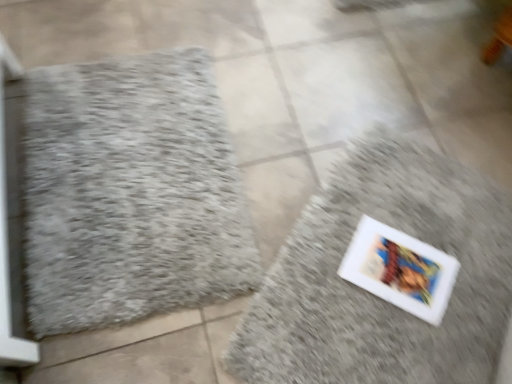
Question: Is gray fluffy bath mat at left, which appears as the 1th bath mat when viewed from the left, shorter than white matte book at lower right, marked as the second bath mat in a left-to-right arrangement?

Choices:
 (A) yes
 (B) no

Answer: (A)

Question: Considering the relative sizes of gray fluffy bath mat at left, the 2th bath mat when ordered from right to left, and white matte book at lower right, the first bath mat from the right, in the image provided, is gray fluffy bath mat at left, the 2th bath mat when ordered from right to left, smaller than white matte book at lower right, the first bath mat from the right,?

Choices:
 (A) yes
 (B) no

Answer: (A)

Question: From the image's perspective, is gray fluffy bath mat at left, which appears as the 1th bath mat when viewed from the left, located beneath white matte book at lower right, the first bath mat from the right?

Choices:
 (A) no
 (B) yes

Answer: (A)

Question: Is gray fluffy bath mat at left, the 2th bath mat when ordered from right to left, further to the viewer compared to white matte book at lower right, marked as the second bath mat in a left-to-right arrangement?

Choices:
 (A) no
 (B) yes

Answer: (B)

Question: Is the position of gray fluffy bath mat at left, which appears as the 1th bath mat when viewed from the left, less distant than that of white matte book at lower right, marked as the second bath mat in a left-to-right arrangement?

Choices:
 (A) yes
 (B) no

Answer: (B)

Question: Can white matte book at lower right, marked as the second bath mat in a left-to-right arrangement, be found inside gray fluffy bath mat at left, which appears as the 1th bath mat when viewed from the left?

Choices:
 (A) no
 (B) yes

Answer: (A)

Question: From the image's perspective, is white matte book at lower right, marked as the second bath mat in a left-to-right arrangement, beneath gray fluffy bath mat at left, the 2th bath mat when ordered from right to left?

Choices:
 (A) no
 (B) yes

Answer: (B)

Question: Does white matte book at lower right, the first bath mat from the right, have a lesser height compared to gray fluffy bath mat at left, which appears as the 1th bath mat when viewed from the left?

Choices:
 (A) yes
 (B) no

Answer: (B)

Question: Is white matte book at lower right, marked as the second bath mat in a left-to-right arrangement, positioned beyond the bounds of gray fluffy bath mat at left, which appears as the 1th bath mat when viewed from the left?

Choices:
 (A) no
 (B) yes

Answer: (B)

Question: Is gray fluffy bath mat at left, the 2th bath mat when ordered from right to left, surrounded by white matte book at lower right, marked as the second bath mat in a left-to-right arrangement?

Choices:
 (A) no
 (B) yes

Answer: (A)

Question: Is white matte book at lower right, the first bath mat from the right, positioned far away from gray fluffy bath mat at left, the 2th bath mat when ordered from right to left?

Choices:
 (A) yes
 (B) no

Answer: (B)

Question: Is white matte book at lower right, the first bath mat from the right, positioned in front of gray fluffy bath mat at left, which appears as the 1th bath mat when viewed from the left?

Choices:
 (A) no
 (B) yes

Answer: (B)

Question: Is gray fluffy bath mat at left, the 2th bath mat when ordered from right to left, inside the boundaries of white matte book at lower right, marked as the second bath mat in a left-to-right arrangement, or outside?

Choices:
 (A) outside
 (B) inside

Answer: (A)